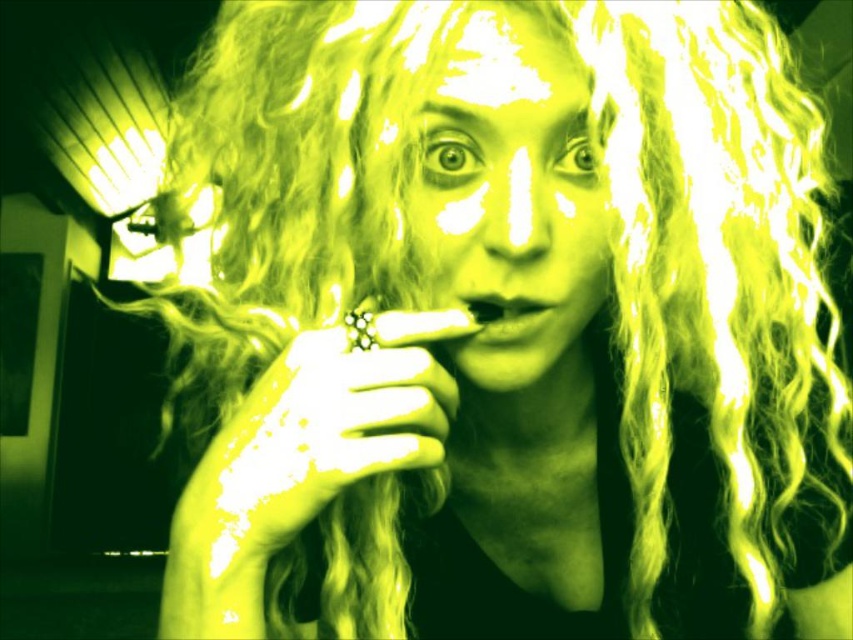
Question: Among these points, which one is farthest from the camera?

Choices:
 (A) (532, 305)
 (B) (556, 76)

Answer: (A)

Question: From the image, what is the correct spatial relationship of matte yellow face at center in relation to smooth matte mouth at center?

Choices:
 (A) below
 (B) above

Answer: (B)

Question: Which point appears farthest from the camera in this image?

Choices:
 (A) (442, 154)
 (B) (497, 339)

Answer: (A)

Question: Can you confirm if matte yellow face at center is thinner than smooth matte mouth at center?

Choices:
 (A) no
 (B) yes

Answer: (A)

Question: Can you confirm if matte yellow face at center is bigger than smooth matte mouth at center?

Choices:
 (A) no
 (B) yes

Answer: (B)